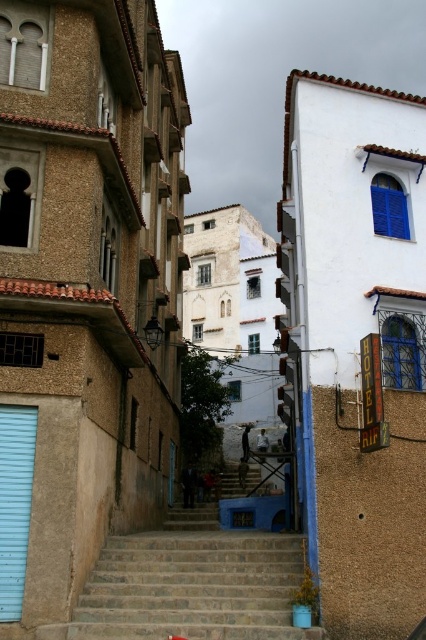
You are a delivery person trying to navigate through the narrow street. You need to deliver a large package that requires a path wider than the light blue matte garage door at lower left. Is the brown stone stairs at center wide enough for your delivery vehicle?

The brown stone stairs at center is bigger than the light blue matte garage door at lower left, so the stairs are wider and can accommodate the delivery vehicle.

Looking at this image, you are a tourist standing at the top of the brown stone stairs at center and want to reach the light blue matte garage door at lower left. Which direction should you move to get there?

The light blue matte garage door at lower left is above the brown stone stairs at center, so you should move upward to reach it.